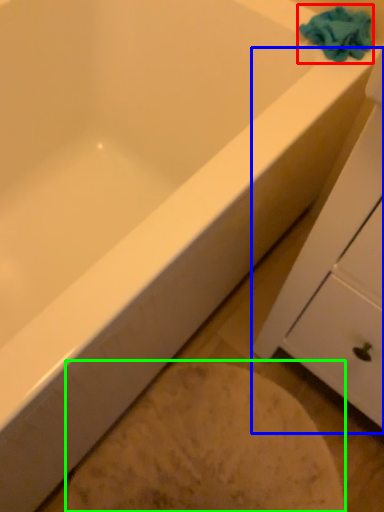
Question: Based on their relative distances, which object is nearer to bath towel (highlighted by a red box)? Choose from cabinetry (highlighted by a blue box) and porcelain (highlighted by a green box).

Choices:
 (A) cabinetry
 (B) porcelain

Answer: (A)